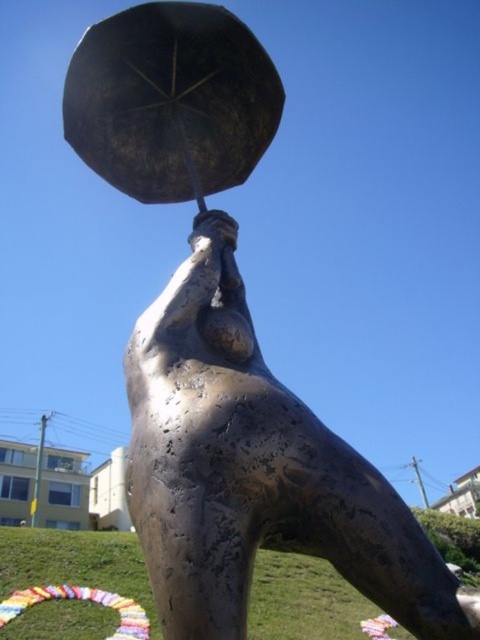
Question: Which point is farther to the camera?

Choices:
 (A) bronze statue at center
 (B) shiny bronze umbrella at upper center

Answer: (B)

Question: Does bronze statue at center come behind shiny bronze umbrella at upper center?

Choices:
 (A) yes
 (B) no

Answer: (B)

Question: Which point is closer to the camera?

Choices:
 (A) shiny bronze umbrella at upper center
 (B) bronze statue at center

Answer: (B)

Question: Observing the image, what is the correct spatial positioning of bronze statue at center in reference to shiny bronze umbrella at upper center?

Choices:
 (A) right
 (B) left

Answer: (A)

Question: Among these objects, which one is nearest to the camera?

Choices:
 (A) shiny bronze umbrella at upper center
 (B) bronze statue at center

Answer: (B)

Question: Is bronze statue at center behind shiny bronze umbrella at upper center?

Choices:
 (A) no
 (B) yes

Answer: (A)